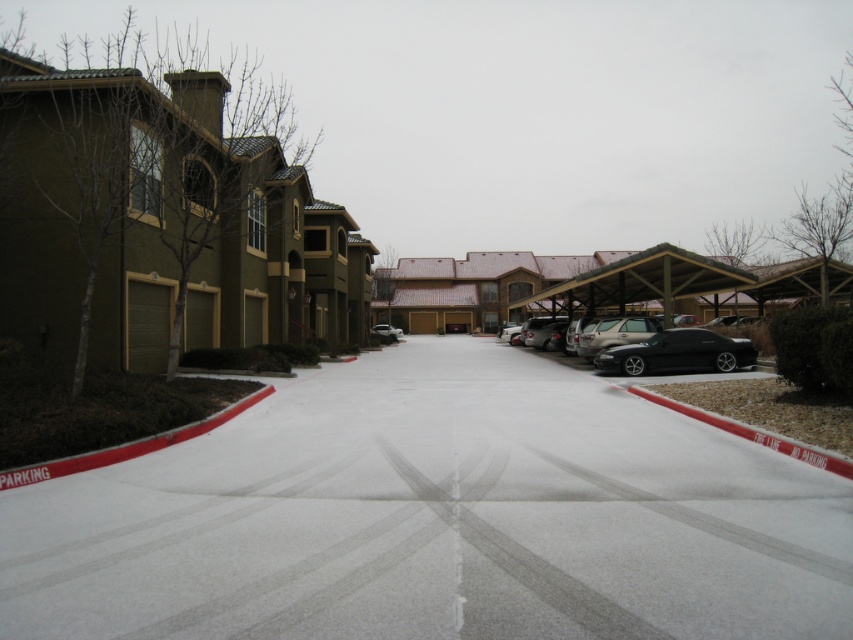
The image size is (853, 640). Identify the location of satin gold suv at center. (616, 333).

Does point (589, 332) come in front of point (375, 332)?

Yes, it is.

What do you see at coordinates (616, 333) in the screenshot? I see `satin gold suv at center` at bounding box center [616, 333].

Find the location of `satin gold suv at center`. satin gold suv at center is located at coordinates (616, 333).

Which of these two, black matte car at right or satin silver sedan at center, stands taller?

With more height is satin silver sedan at center.

Does black matte car at right appear on the right side of satin silver sedan at center?

Yes, black matte car at right is to the right of satin silver sedan at center.

Locate an element on the screen. This screenshot has height=640, width=853. black matte car at right is located at coordinates (677, 353).

Which is behind, point (265, 589) or point (376, 333)?

Point (376, 333)

Where is `white asphalt parking lot at center`? Image resolution: width=853 pixels, height=640 pixels. white asphalt parking lot at center is located at coordinates (436, 516).